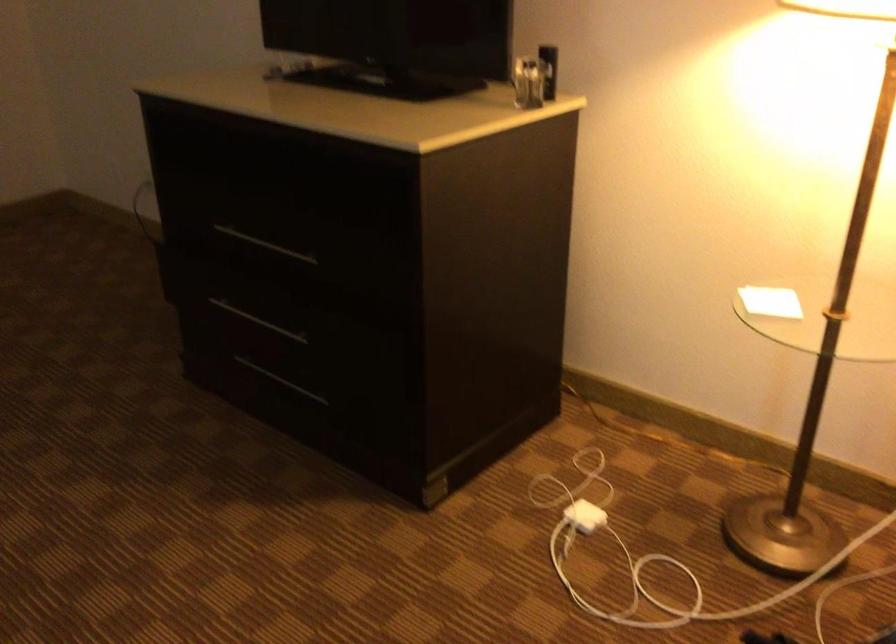
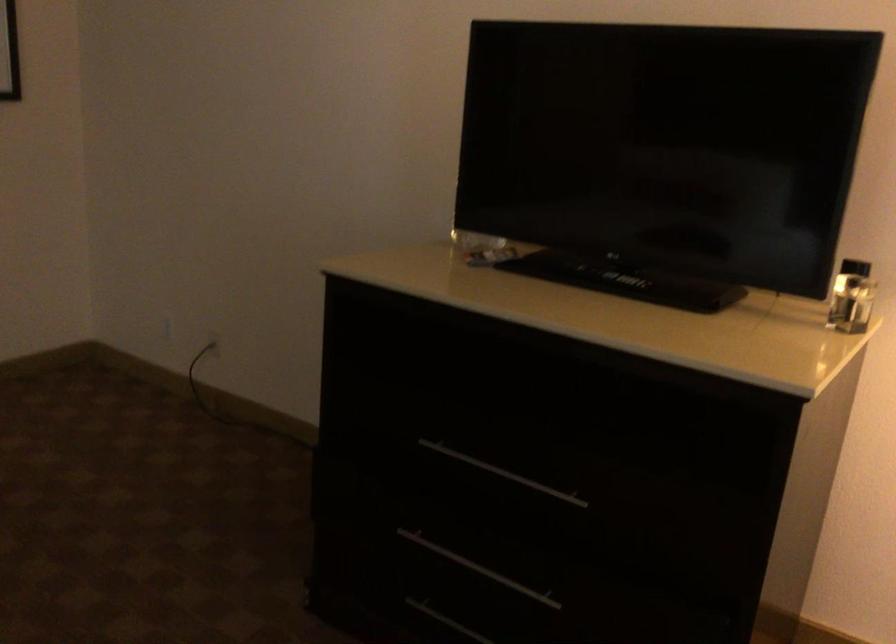
Where in the second image is the point corresponding to pixel 257 321 from the first image?

(478, 567)